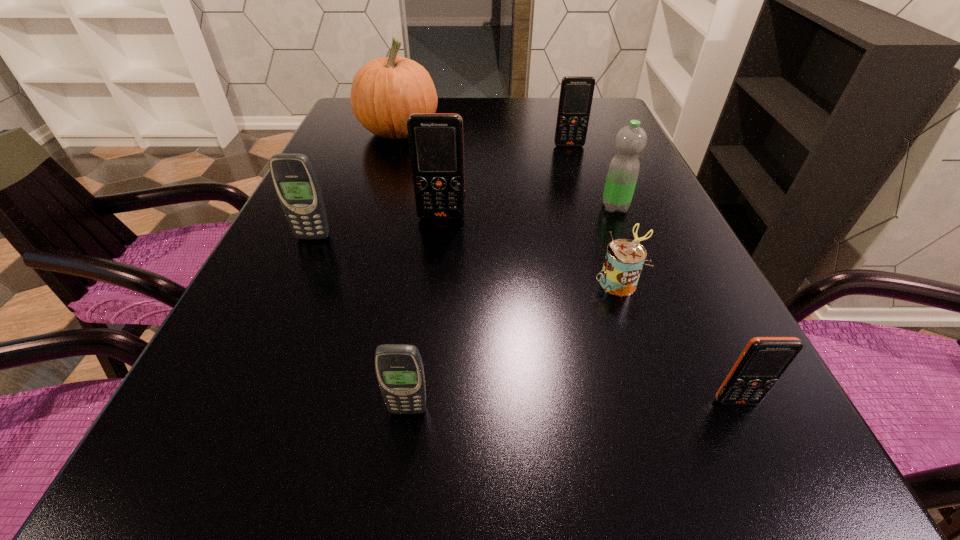
This screenshot has height=540, width=960. I want to click on vacant region located 0.120m on the screen of the right gray cellular telephone, so click(395, 509).

Find the location of a particular element. The width and height of the screenshot is (960, 540). free region located on the right of the sixth farthest object is located at coordinates (688, 281).

Locate an element on the screen. This screenshot has width=960, height=540. object located in the far edge section of the desktop is located at coordinates (385, 91).

In order to click on pumpkin that is at the left edge in this screenshot , I will do `click(385, 91)`.

Identify the location of cellular telephone situated at the left edge. click(294, 178).

Locate an element on the screen. This screenshot has height=540, width=960. water bottle at the right edge is located at coordinates (623, 171).

I want to click on can at the right edge, so click(624, 260).

The image size is (960, 540). Identify the location of object that is at the far left corner. point(385,91).

Locate an element on the screen. free space at the far edge of the desktop is located at coordinates (553, 101).

Find the location of a particular element. vacant space at the near edge is located at coordinates tap(468, 515).